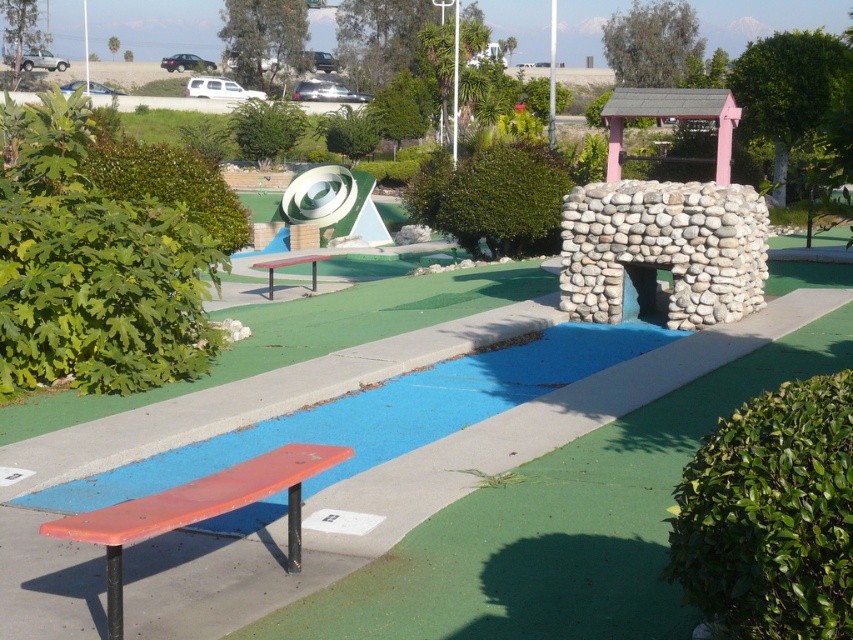
Is matte orange bench at lower left positioned in front of red painted wood bench at center?

Yes, it is in front of red painted wood bench at center.

Can you confirm if matte orange bench at lower left is wider than red painted wood bench at center?

Yes, matte orange bench at lower left is wider than red painted wood bench at center.

Does point (119, 563) lie behind point (312, 268)?

No, (119, 563) is closer to viewer.

The height and width of the screenshot is (640, 853). What are the coordinates of `matte orange bench at lower left` in the screenshot? It's located at (198, 509).